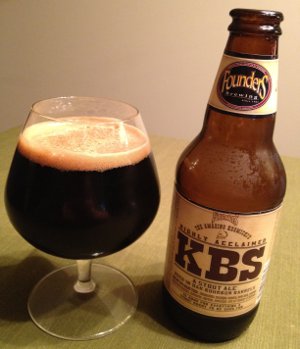
Identify the location of table. (274, 299).